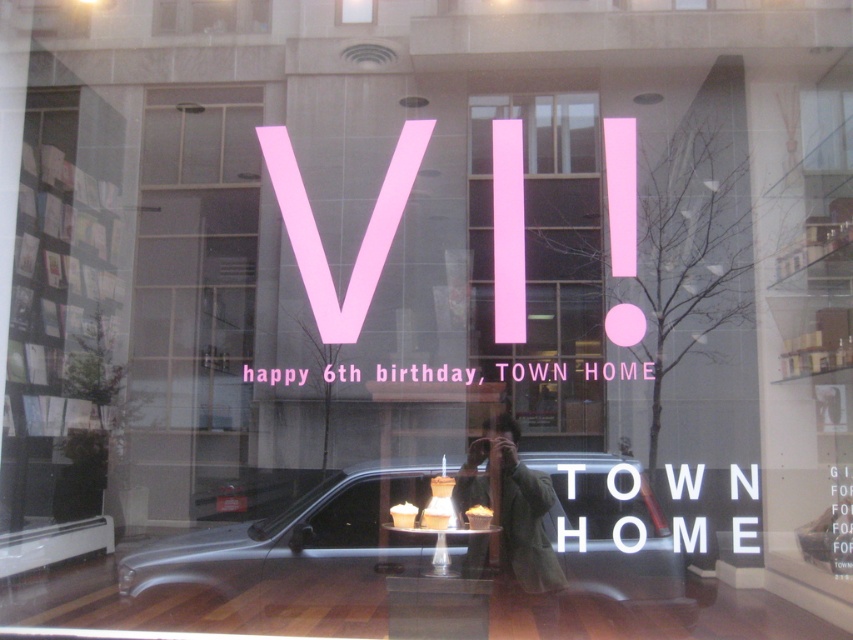
Does point (274, 554) come behind point (587, 330)?

No, (274, 554) is in front of (587, 330).

Can you confirm if silver metallic car at center is taller than pink matte sign at center?

No, silver metallic car at center is not taller than pink matte sign at center.

What do you see at coordinates (300, 540) in the screenshot?
I see `silver metallic car at center` at bounding box center [300, 540].

I want to click on silver metallic car at center, so click(300, 540).

Is point (569, 435) farther from camera compared to point (508, 502)?

Yes.

Looking at this image, is pink matte sign at center shorter than green fabric jacket at center?

In fact, pink matte sign at center may be taller than green fabric jacket at center.

Which is in front, point (486, 257) or point (500, 512)?

Point (500, 512) is in front.

Locate an element on the screen. Image resolution: width=853 pixels, height=640 pixels. pink matte sign at center is located at coordinates pos(544,264).

Does silver metallic car at center appear on the right side of green fabric jacket at center?

In fact, silver metallic car at center is to the left of green fabric jacket at center.

Which is behind, point (532, 500) or point (535, 572)?

The point (532, 500) is behind.

This screenshot has width=853, height=640. What are the coordinates of `silver metallic car at center` in the screenshot? It's located at [x=300, y=540].